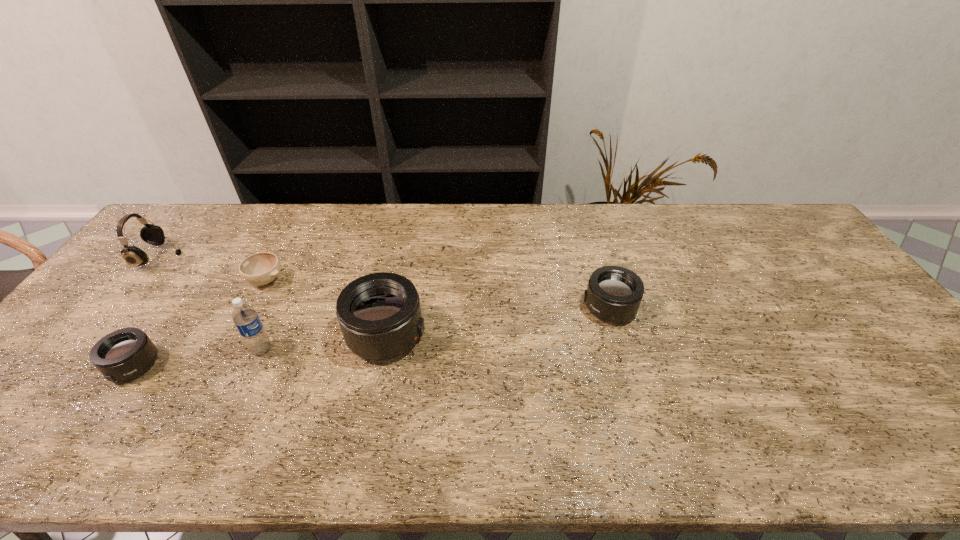
You are a GUI agent. You are given a task and a screenshot of the screen. Output one action in this format:
    pyautogui.click(x=<x>, y=<y>)
    Task: Click on the vacant area in the image that satisfies the following two spatial constraints: 1. with the microphone on the side of the water bottle; 2. on the left side of the headset
    The width and height of the screenshot is (960, 540).
    Given the screenshot: What is the action you would take?
    pyautogui.click(x=84, y=349)

The height and width of the screenshot is (540, 960). Identify the location of free space that satisfies the following two spatial constraints: 1. on the side of the rightmost object with brand markings and control switches; 2. on the side of the leftmost telephoto lens with brand markings and control switches. (626, 366).

This screenshot has height=540, width=960. Identify the location of vacant space that satisfies the following two spatial constraints: 1. with the microphone on the side of the leftmost object; 2. on the right side of the tallest object. (84, 349).